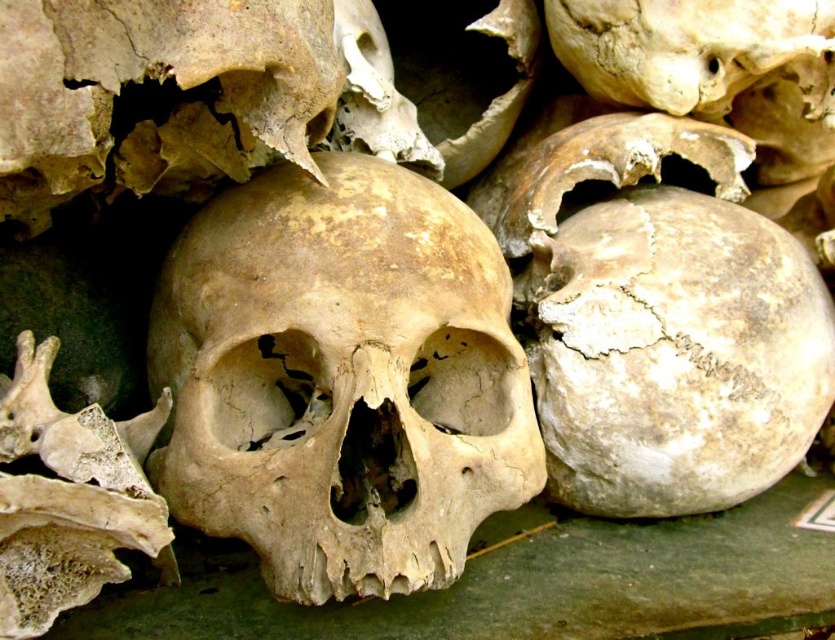
Question: Which of the following is the farthest from the observer?

Choices:
 (A) (732, 339)
 (B) (367, 448)

Answer: (A)

Question: Which of these objects is positioned closest to the brown porous skull at center?

Choices:
 (A) bone-like textured bone fragment at lower left
 (B) white cracked skull at center

Answer: (A)

Question: Considering the relative positions of white cracked skull at center and bone-like textured bone fragment at lower left in the image provided, where is white cracked skull at center located with respect to bone-like textured bone fragment at lower left?

Choices:
 (A) left
 (B) right

Answer: (B)

Question: Can you confirm if brown porous skull at center is wider than white cracked skull at center?

Choices:
 (A) no
 (B) yes

Answer: (B)

Question: Which point is farther to the camera?

Choices:
 (A) (215, 484)
 (B) (4, 621)
 (C) (660, 458)

Answer: (C)

Question: Is brown porous skull at center to the left of white cracked skull at center from the viewer's perspective?

Choices:
 (A) no
 (B) yes

Answer: (B)